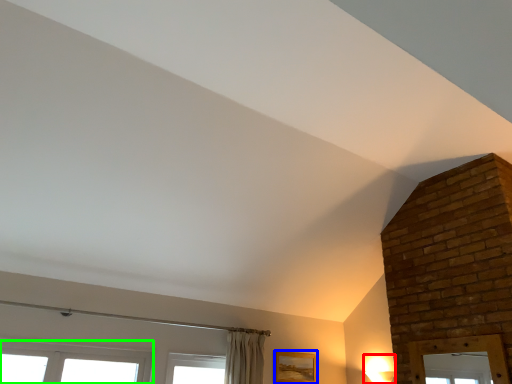
Question: Which object is positioned closest to light fixture (highlighted by a red box)? Select from picture frame (highlighted by a blue box) and window (highlighted by a green box).

Choices:
 (A) picture frame
 (B) window

Answer: (A)